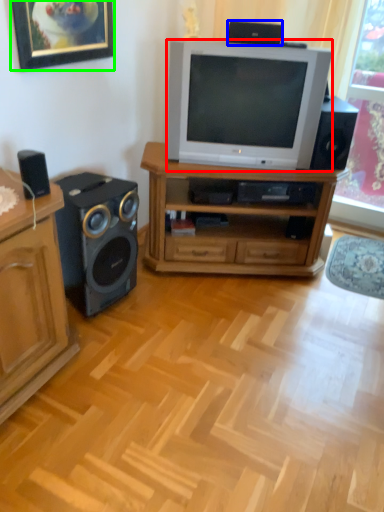
Question: Which is nearer to the television (highlighted by a red box)? loudspeaker (highlighted by a blue box) or picture frame (highlighted by a green box).

Choices:
 (A) loudspeaker
 (B) picture frame

Answer: (A)